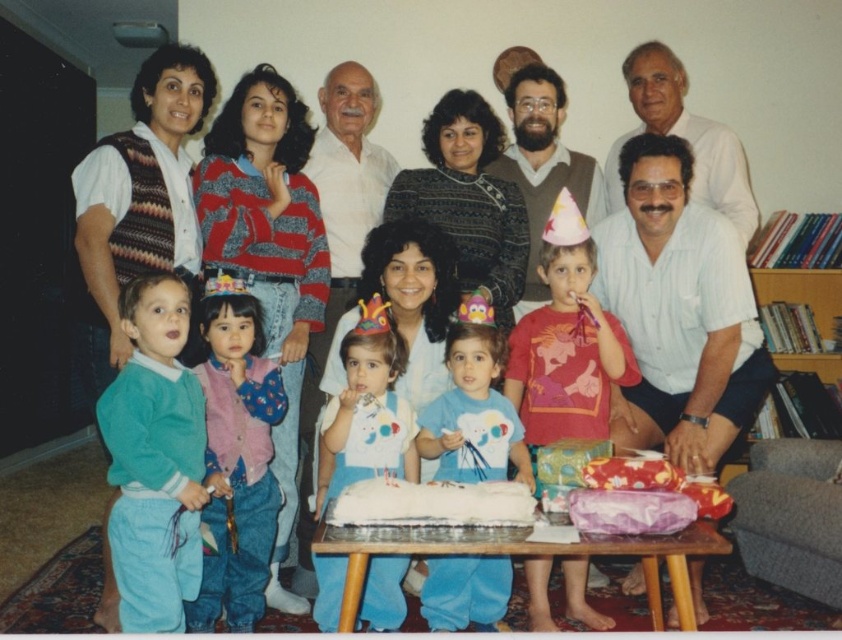
Looking at this image, who is lower down, fluffy pink vest at center or blue cotton shirt at center?

fluffy pink vest at center is lower down.

Is point (253, 605) closer to camera compared to point (451, 616)?

Yes, it is in front of point (451, 616).

Based on the photo, who is more distant from viewer, (228, 362) or (456, 627)?

The point (456, 627) is more distant.

This screenshot has height=640, width=842. I want to click on fluffy pink vest at center, so click(x=236, y=460).

Between teal fleece sweater at left and fluffy pink vest at center, which one has more height?

With more height is fluffy pink vest at center.

Does teal fleece sweater at left come behind fluffy pink vest at center?

No, teal fleece sweater at left is in front of fluffy pink vest at center.

Describe the element at coordinates (155, 460) in the screenshot. I see `teal fleece sweater at left` at that location.

Where is `teal fleece sweater at left`? teal fleece sweater at left is located at coordinates (155, 460).

Between point (120, 596) and point (396, 488), which one is positioned in front?

Point (396, 488) is more forward.

Is teal fleece sweater at left positioned behind white frosted cake at center?

Yes.

The width and height of the screenshot is (842, 640). What do you see at coordinates (155, 460) in the screenshot? I see `teal fleece sweater at left` at bounding box center [155, 460].

Identify the location of teal fleece sweater at left. The image size is (842, 640). (155, 460).